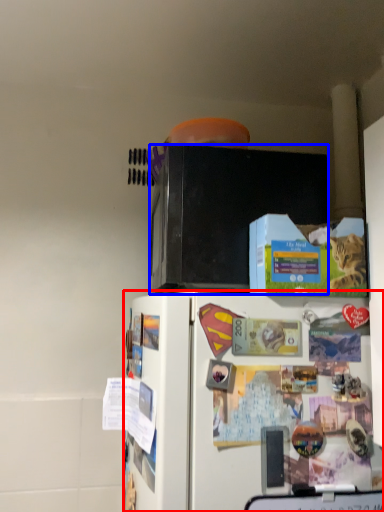
Question: Which object appears closest to the camera in this image, refrigerator (highlighted by a red box) or microwave oven (highlighted by a blue box)?

Choices:
 (A) refrigerator
 (B) microwave oven

Answer: (A)